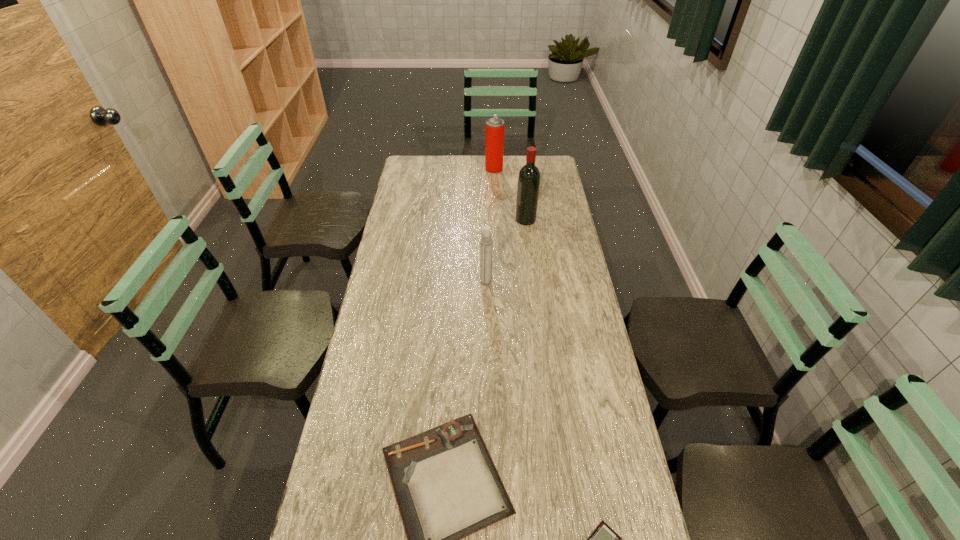
I want to click on wine bottle, so click(x=529, y=176).

Locate an element on the screen. This screenshot has height=540, width=960. the tallest object is located at coordinates (529, 176).

Locate an element on the screen. The height and width of the screenshot is (540, 960). the farthest object is located at coordinates (494, 131).

Find the location of `the nearer aerosol can`. the nearer aerosol can is located at coordinates (486, 242).

Where is `vacant area situated on the label of the second farthest object`? vacant area situated on the label of the second farthest object is located at coordinates (451, 219).

You are a GUI agent. You are given a task and a screenshot of the screen. Output one action in this format:
    pyautogui.click(x=<x>, y=<y>)
    Task: Click on the vacant space situated on the label of the second farthest object
    
    Given the screenshot: What is the action you would take?
    pyautogui.click(x=482, y=219)

At what (x,y) coordinates should I click in order to perform the action: click on free spot located on the label of the second farthest object. Please return your answer as a coordinate pair (x, y). Looking at the image, I should click on (465, 219).

Locate an element on the screen. This screenshot has width=960, height=540. free spot located on the left of the farthest object is located at coordinates (456, 169).

Image resolution: width=960 pixels, height=540 pixels. I want to click on vacant region located 0.320m on the left of the nearer aerosol can, so click(397, 282).

Where is `object at the far edge`? The width and height of the screenshot is (960, 540). object at the far edge is located at coordinates (494, 131).